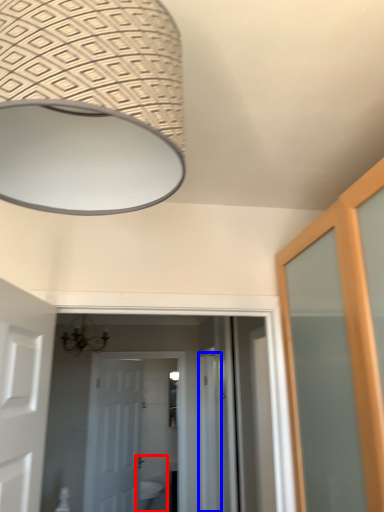
Question: Which object appears farthest to the camera in this image, sink (highlighted by a red box) or screen door (highlighted by a blue box)?

Choices:
 (A) sink
 (B) screen door

Answer: (A)